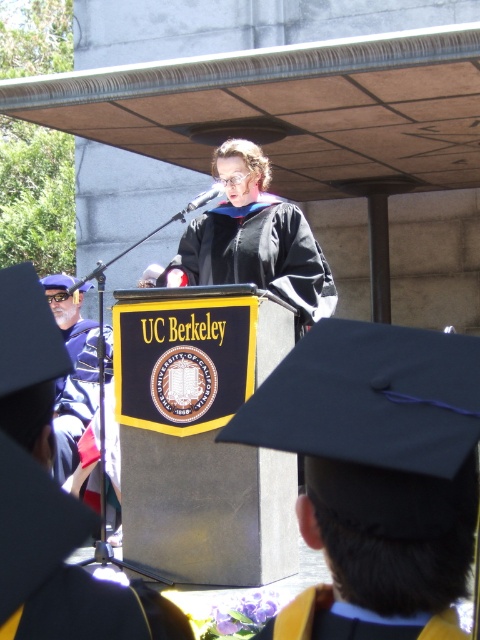
You are attending the UC Berkeley graduation ceremony and notice the matte black graduation gown at center. Where is it positioned in relation to the podium?

The matte black graduation gown at center is located at point (257, 256), which places it slightly to the right and above the podium.

You are a photographer at the UC Berkeley graduation ceremony. You need to capture a photo of both the matte black graduation gown at center and the matte black graduation gown at left. Which gown should you focus on first if you want to ensure both are in frame without moving the camera?

The matte black graduation gown at left should be focused on first because the matte black graduation gown at center is wider, so positioning the camera to include the wider gown ensures the narrower one at left will also fit within the frame.